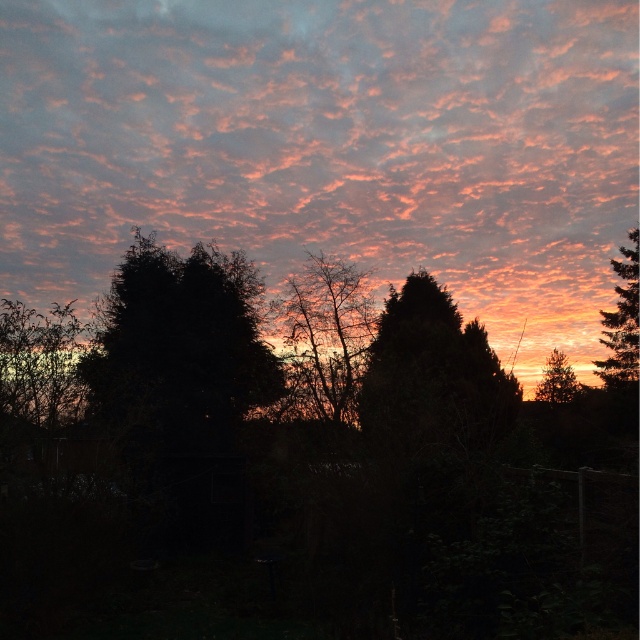
You are standing at point (476, 131). You want to walk to the point that is 37.40 meters away from you. Is there a clear path to that point, considering the trees and shrubs in the foreground?

The point (476, 131) is 37.40 meters away from you. However, the foreground contains silhouettes of various trees and shrubs, which may block your path. You should check the area for any obstructions before proceeding.

You are standing at the edge of a field looking at the sunset scene. You want to know how far the matte pink cloud at upper center is from you. Can you determine the distance?

The matte pink cloud at upper center is 85.09 feet away from the viewer.

You are an astronomer observing the sunset scene. You notice the matte pink cloud at upper center. Based on its position, can you determine if it is closer to the horizon or the top of the sky?

The matte pink cloud at upper center is located at point coordinates that are closer to the horizon than the top of the sky. Since its y coordinate is 0.516, which is just over halfway between the horizon and the top, it is slightly closer to the horizon.